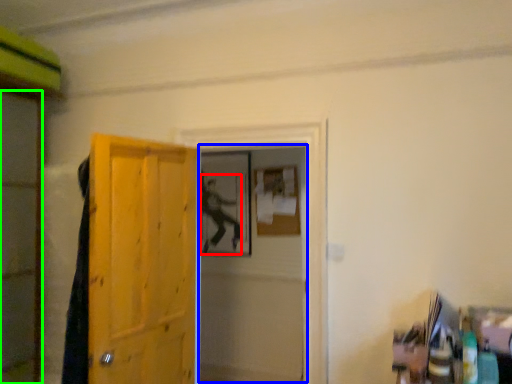
Question: Estimate the real-world distances between objects in this image. Which object is farther from person (highlighted by a red box), screen door (highlighted by a blue box) or screen door (highlighted by a green box)?

Choices:
 (A) screen door
 (B) screen door

Answer: (B)